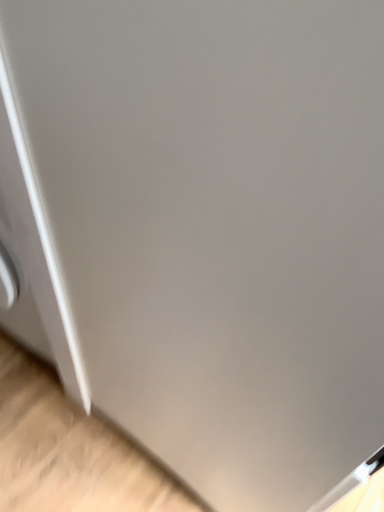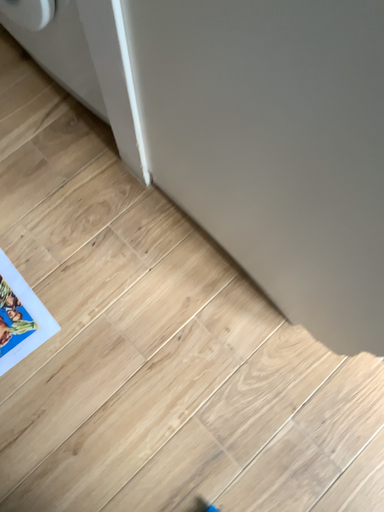
Question: Which way did the camera rotate in the video?

Choices:
 (A) rotated downward
 (B) rotated upward

Answer: (A)